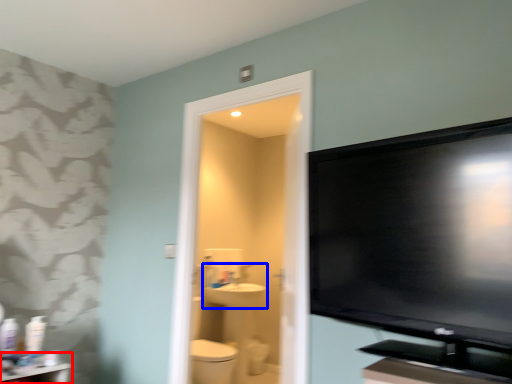
Question: Which object is further to the camera taking this photo, table (highlighted by a red box) or sink (highlighted by a blue box)?

Choices:
 (A) table
 (B) sink

Answer: (B)